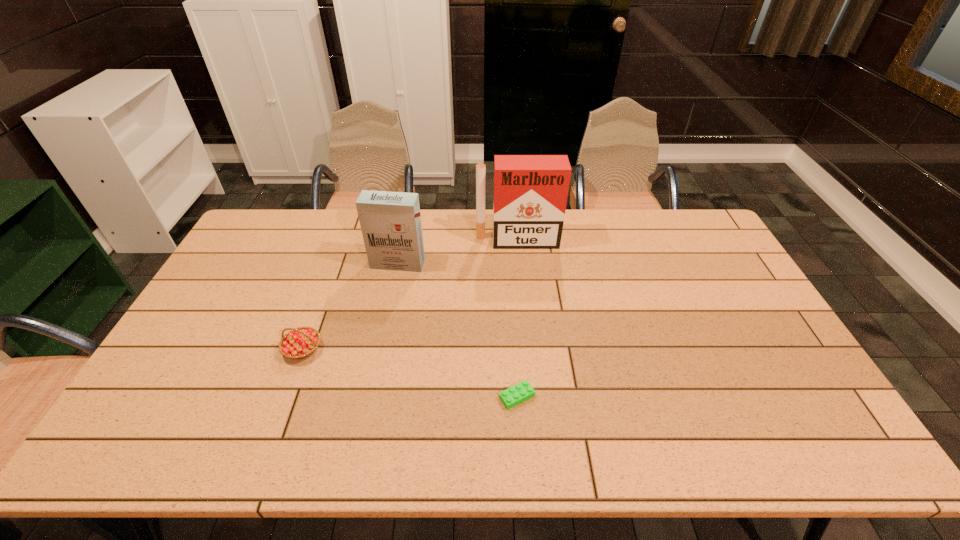
Find the location of a particular element. free space located on the back of the strawberry is located at coordinates (327, 281).

Where is `free space located 0.130m on the back of the shortest object`? free space located 0.130m on the back of the shortest object is located at coordinates (514, 345).

Find the location of a particular element. This screenshot has height=540, width=960. object that is at the far edge is located at coordinates (530, 195).

I want to click on vacant area at the far edge of the desktop, so click(649, 217).

Find the location of a particular element. vacant space at the near edge of the desktop is located at coordinates (341, 434).

I want to click on vacant position at the left edge of the desktop, so click(x=215, y=337).

Image resolution: width=960 pixels, height=540 pixels. In order to click on blank space at the right edge of the desktop in this screenshot , I will do `click(753, 347)`.

The image size is (960, 540). In order to click on vacant space at the far left corner in this screenshot , I will do `click(272, 242)`.

In the image, there is a desktop. What are the coordinates of `vacant area at the far right corner` in the screenshot? It's located at (691, 239).

Find the location of a particular element. unoccupied area between the farther cigarette case and the Lego is located at coordinates (517, 319).